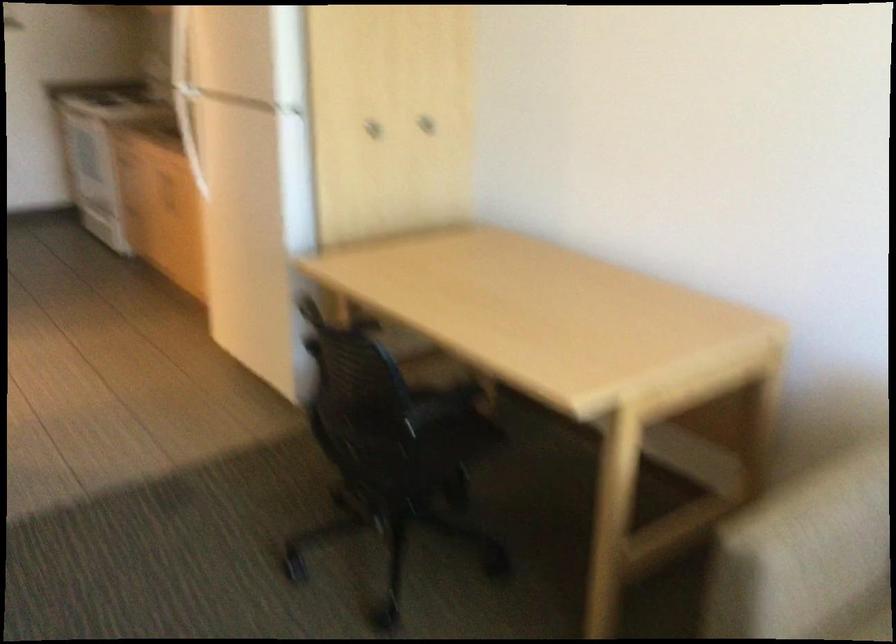
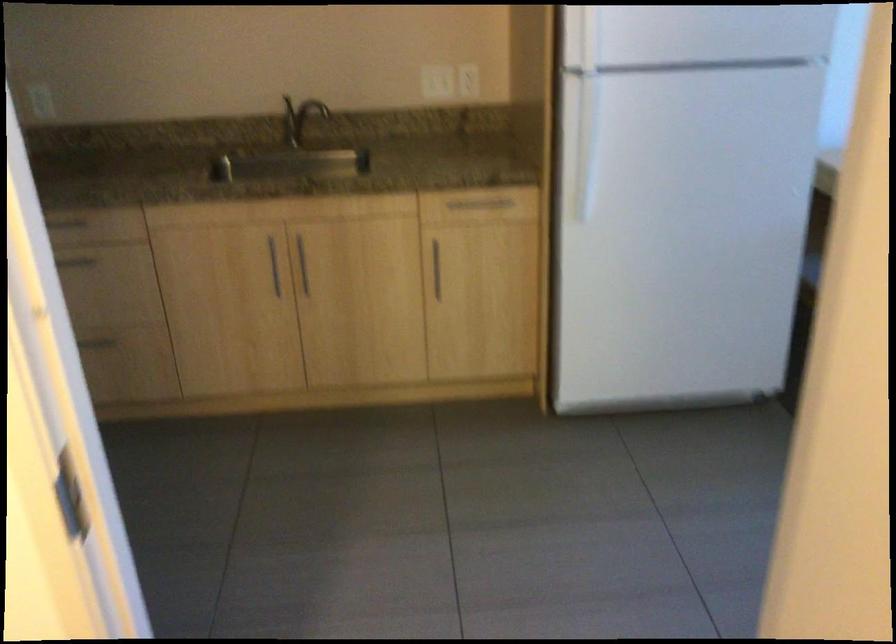
In the second image, find the point that corresponds to point (186, 187) in the first image.

(273, 265)